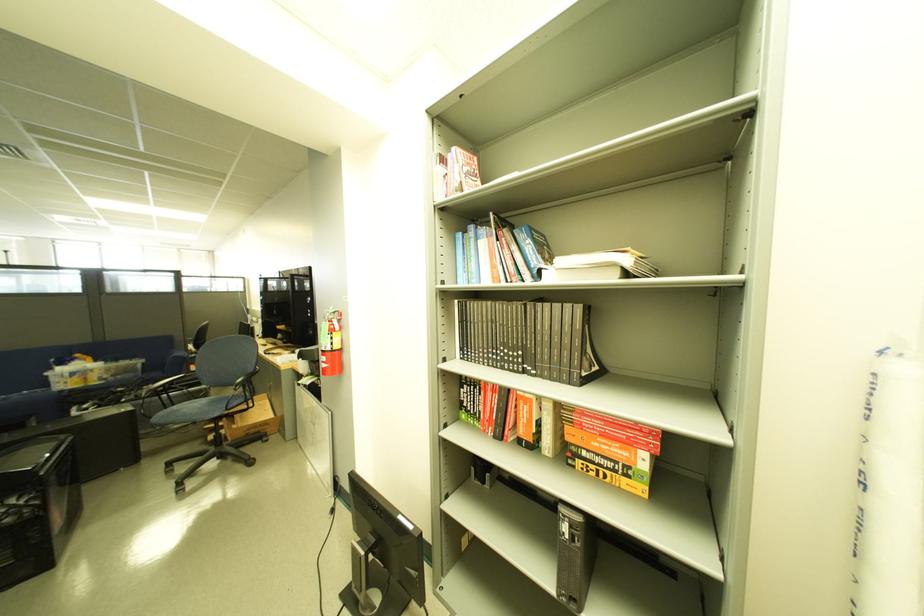
The location [35,505] corresponds to which object?

This point indicates the small PC tower.